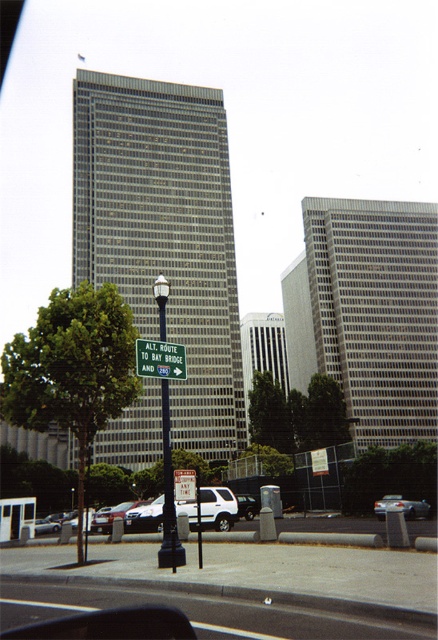
Consider the image. Between shiny silver sedan at center and white matte suv at center, which one is positioned higher?

shiny silver sedan at center is higher up.

Which is in front, point (414, 506) or point (257, 502)?

Point (414, 506) is more forward.

The image size is (438, 640). I want to click on shiny silver sedan at center, so click(x=402, y=506).

Is silver metallic sedan at center further to camera compared to silver metallic sedan at lower left?

No, silver metallic sedan at center is closer to the viewer.

Is silver metallic sedan at center bigger than silver metallic sedan at lower left?

Yes, silver metallic sedan at center is bigger than silver metallic sedan at lower left.

Is point (133, 506) less distant than point (52, 525)?

Yes, it is in front of point (52, 525).

Find the location of a particular element. Image resolution: width=438 pixels, height=640 pixels. silver metallic sedan at center is located at coordinates (109, 516).

Is point (159, 364) farther from viewer compared to point (254, 504)?

No, it is in front of (254, 504).

Between green plastic sign at center and white matte suv at center, which one has less height?

With less height is green plastic sign at center.

Is point (151, 369) closer to camera compared to point (247, 497)?

Yes.

You are a GUI agent. You are given a task and a screenshot of the screen. Output one action in this format:
    pyautogui.click(x=<x>, y=<y>)
    Task: Click on the green plastic sign at center
    
    Given the screenshot: What is the action you would take?
    pyautogui.click(x=159, y=358)